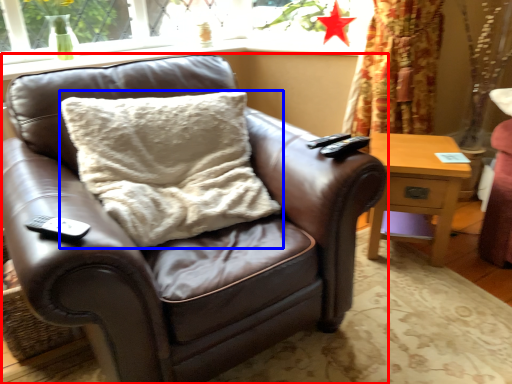
Question: Which object appears closest to the camera in this image, chair (highlighted by a red box) or pillow (highlighted by a blue box)?

Choices:
 (A) chair
 (B) pillow

Answer: (A)